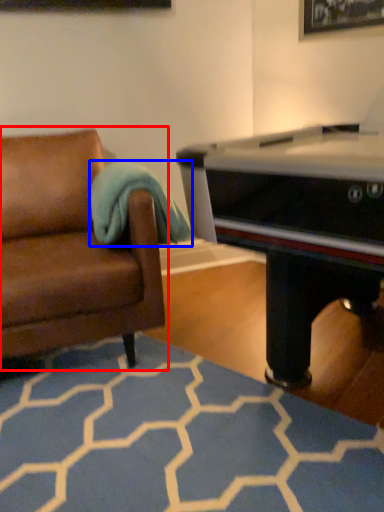
Question: Which object appears farthest to the camera in this image, studio couch (highlighted by a red box) or blanket (highlighted by a blue box)?

Choices:
 (A) studio couch
 (B) blanket

Answer: (B)